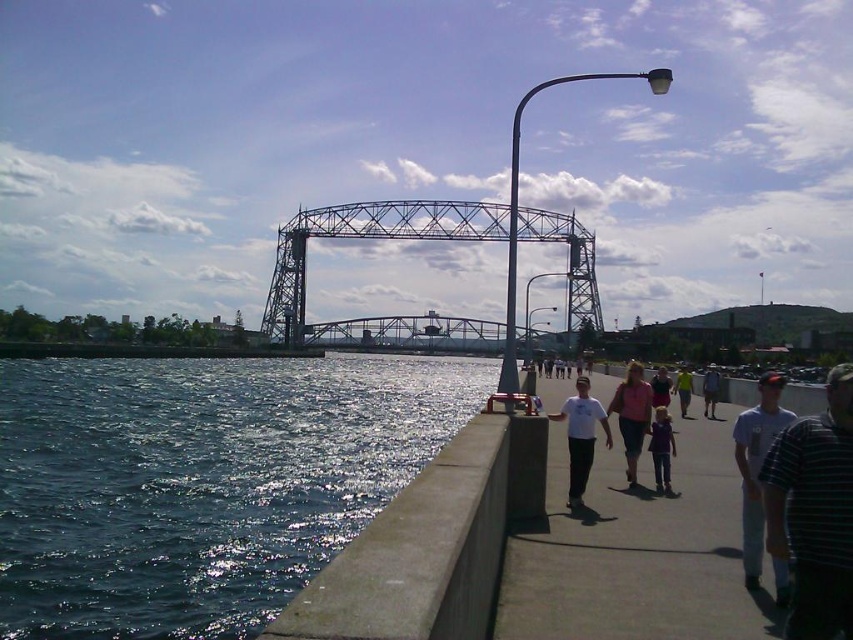
Question: Is dark blue concrete at lower left closer to camera compared to striped shirt at right?

Choices:
 (A) yes
 (B) no

Answer: (B)

Question: Is metallic bridge at center above blue denim jeans at center?

Choices:
 (A) no
 (B) yes

Answer: (B)

Question: Which point appears farthest from the camera in this image?

Choices:
 (A) (303, 243)
 (B) (664, 492)

Answer: (A)

Question: Among these points, which one is nearest to the camera?

Choices:
 (A) (770, 397)
 (B) (677, 394)
 (C) (659, 444)

Answer: (A)

Question: Which object is the farthest from the metallic bridge at center?

Choices:
 (A) white cotton shirt at right
 (B) purple fabric shirt at center
 (C) white t-shirt at center

Answer: (A)

Question: Can you confirm if pink fabric shirt at center is smaller than matte pink shirt at center?

Choices:
 (A) yes
 (B) no

Answer: (B)